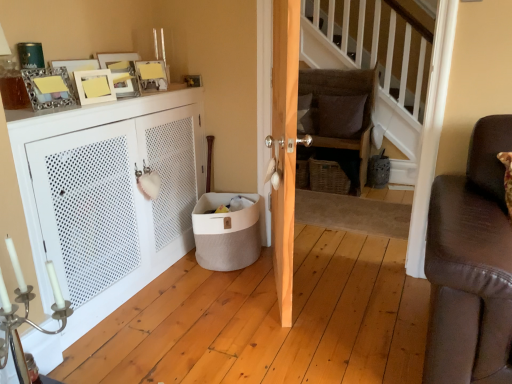
This screenshot has height=384, width=512. In order to click on vacant area that is in front of matte yellow picture frame at upper left, the 4th picture frame when ordered from back to front in this screenshot , I will do `click(75, 104)`.